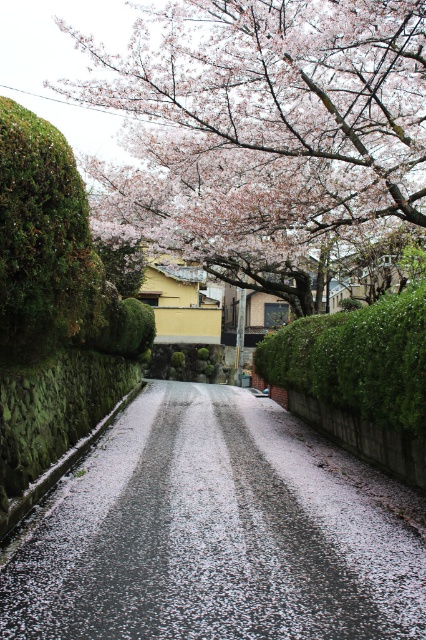
You are a delivery person trying to navigate a narrow road. You see the white textured road at center and smooth pink blossoms at upper center in the image. Which of these two has a greater width?

The smooth pink blossoms at upper center has a greater width than the white textured road at center.

You are a photographer trying to capture the smooth pink blossoms at upper center and the green leafy hedge at center in your shot. Which object should you focus on first if you want to ensure both are in focus without adjusting your camera settings?

You should focus on the smooth pink blossoms at upper center first because it is larger in size compared to the green leafy hedge at center, making it easier to achieve sharp focus on the larger object first.